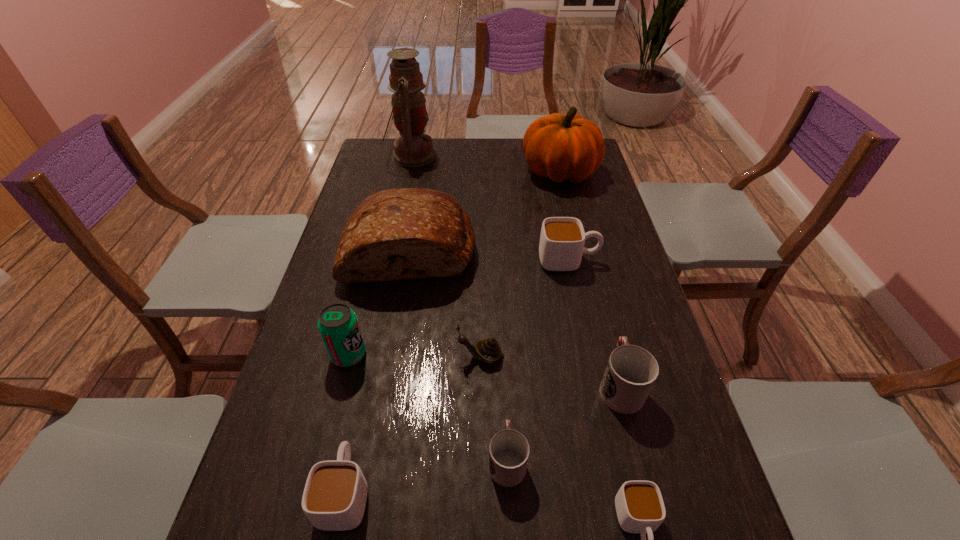
Identify the location of free spot located 0.080m on the handle side of the bigger red cup. The image size is (960, 540). (607, 333).

Image resolution: width=960 pixels, height=540 pixels. Identify the location of vacant space located on the handle side of the bigger red cup. (608, 339).

Identify the location of blank space located on the handle side of the bigger red cup. (597, 298).

I want to click on vacant region located on the face of the snail, so click(x=297, y=357).

Locate an element on the screen. vacant space located on the face of the snail is located at coordinates (304, 357).

You are a GUI agent. You are given a task and a screenshot of the screen. Output one action in this format:
    pyautogui.click(x=<x>, y=<y>)
    Task: Click on the vacant space located on the face of the snail
    This screenshot has width=960, height=540.
    Given the screenshot: What is the action you would take?
    pyautogui.click(x=378, y=357)

Locate an element on the screen. free space located 0.270m on the side with the handle of the leftmost white cup is located at coordinates (374, 347).

Locate an element on the screen. vacant space located 0.070m on the side with the handle of the leftmost white cup is located at coordinates (359, 423).

Identify the location of vacant space situated 0.330m on the side with the handle of the leftmost white cup. (379, 328).

Image resolution: width=960 pixels, height=540 pixels. I want to click on free space located 0.190m on the handle side of the nearer red cup, so (503, 359).